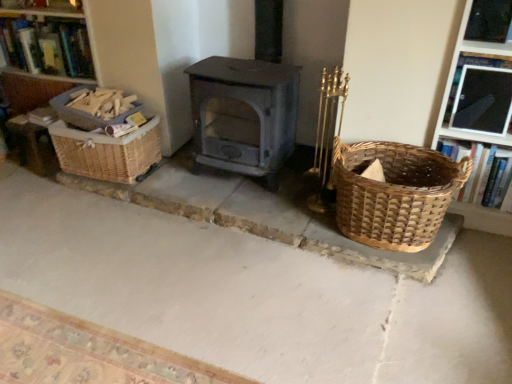
At what (x,y) coordinates should I click in order to perform the action: click on free space to the right of woven brown basket at left, acting as the second basket starting from the right. Please return your answer as a coordinate pair (x, y). Looking at the image, I should click on (177, 175).